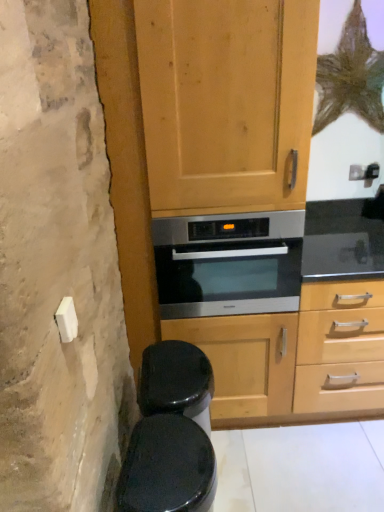
Question: From a real-world perspective, is stainless steel oven at center located higher than black glossy toilet bowl at lower left?

Choices:
 (A) yes
 (B) no

Answer: (A)

Question: From the image's perspective, is stainless steel oven at center located beneath black glossy toilet bowl at lower left?

Choices:
 (A) no
 (B) yes

Answer: (A)

Question: Does stainless steel oven at center turn towards black glossy toilet bowl at lower left?

Choices:
 (A) yes
 (B) no

Answer: (B)

Question: Considering the relative sizes of stainless steel oven at center and black glossy toilet bowl at lower left in the image provided, is stainless steel oven at center shorter than black glossy toilet bowl at lower left?

Choices:
 (A) yes
 (B) no

Answer: (A)

Question: Does stainless steel oven at center have a greater width compared to black glossy toilet bowl at lower left?

Choices:
 (A) no
 (B) yes

Answer: (B)

Question: In terms of size, does wooden cabinet at center appear bigger or smaller than black glossy toilet bowl at lower left?

Choices:
 (A) big
 (B) small

Answer: (A)

Question: In the image, is wooden cabinet at center on the left side or the right side of black glossy toilet bowl at lower left?

Choices:
 (A) left
 (B) right

Answer: (B)

Question: In the image, is wooden cabinet at center positioned in front of or behind black glossy toilet bowl at lower left?

Choices:
 (A) front
 (B) behind

Answer: (B)

Question: From a real-world perspective, relative to black glossy toilet bowl at lower left, is wooden cabinet at center vertically above or below?

Choices:
 (A) above
 (B) below

Answer: (A)

Question: Is black glossy toilet bowl at lower left wider or thinner than stainless steel oven at center?

Choices:
 (A) thin
 (B) wide

Answer: (A)

Question: Looking at the image, does black glossy toilet bowl at lower left seem bigger or smaller compared to stainless steel oven at center?

Choices:
 (A) big
 (B) small

Answer: (B)

Question: Is black glossy toilet bowl at lower left in front of or behind stainless steel oven at center in the image?

Choices:
 (A) front
 (B) behind

Answer: (A)

Question: From the image's perspective, is black glossy toilet bowl at lower left positioned above or below stainless steel oven at center?

Choices:
 (A) above
 (B) below

Answer: (B)

Question: From the image's perspective, is wooden cabinet at center above or below stainless steel oven at center?

Choices:
 (A) above
 (B) below

Answer: (A)

Question: Is point (112, 183) positioned closer to the camera than point (249, 266)?

Choices:
 (A) closer
 (B) farther

Answer: (A)